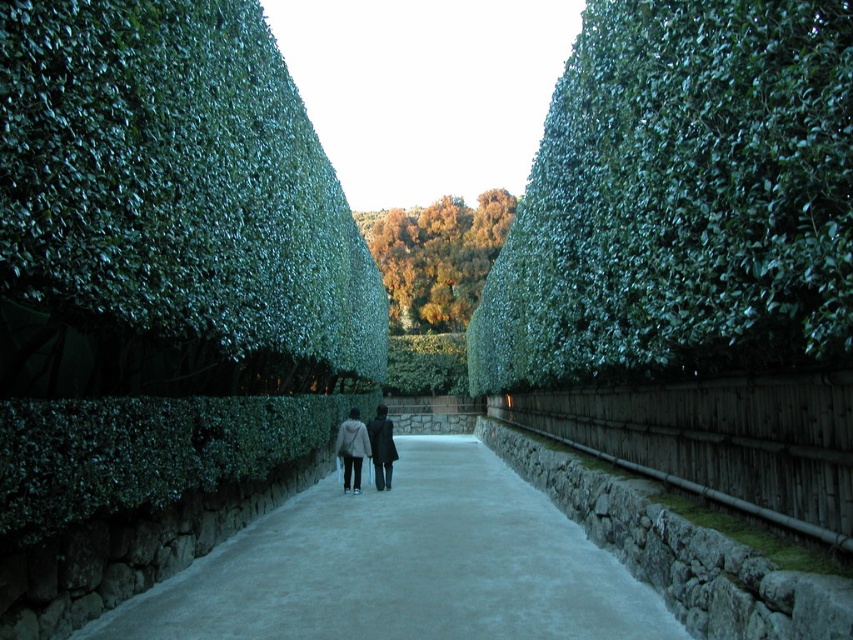
Question: Does smooth concrete path at center appear over dark gray coat at center?

Choices:
 (A) yes
 (B) no

Answer: (A)

Question: Which object is positioned closest to the smooth concrete path at center?

Choices:
 (A) golden textured foliage at center
 (B) green leafy hedge at center

Answer: (B)

Question: Which object is closer to the camera taking this photo?

Choices:
 (A) golden textured foliage at center
 (B) smooth concrete path at center
 (C) dark gray coat at center

Answer: (B)

Question: Is green leafy hedge at center bigger than smooth concrete path at center?

Choices:
 (A) no
 (B) yes

Answer: (B)

Question: Is the position of green leafy hedge at center more distant than that of smooth concrete path at center?

Choices:
 (A) yes
 (B) no

Answer: (B)

Question: Among these objects, which one is farthest from the camera?

Choices:
 (A) smooth concrete path at center
 (B) green leafy hedge at center

Answer: (A)